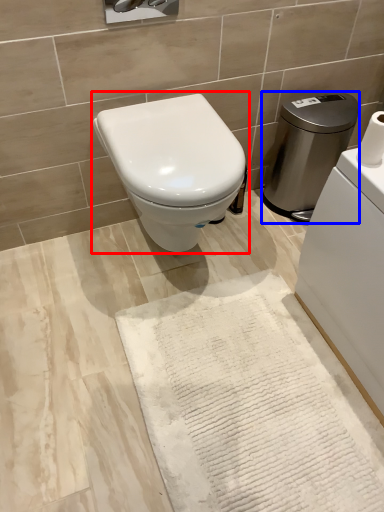
Question: Among these objects, which one is farthest to the camera, toilet (highlighted by a red box) or water heater (highlighted by a blue box)?

Choices:
 (A) toilet
 (B) water heater

Answer: (B)